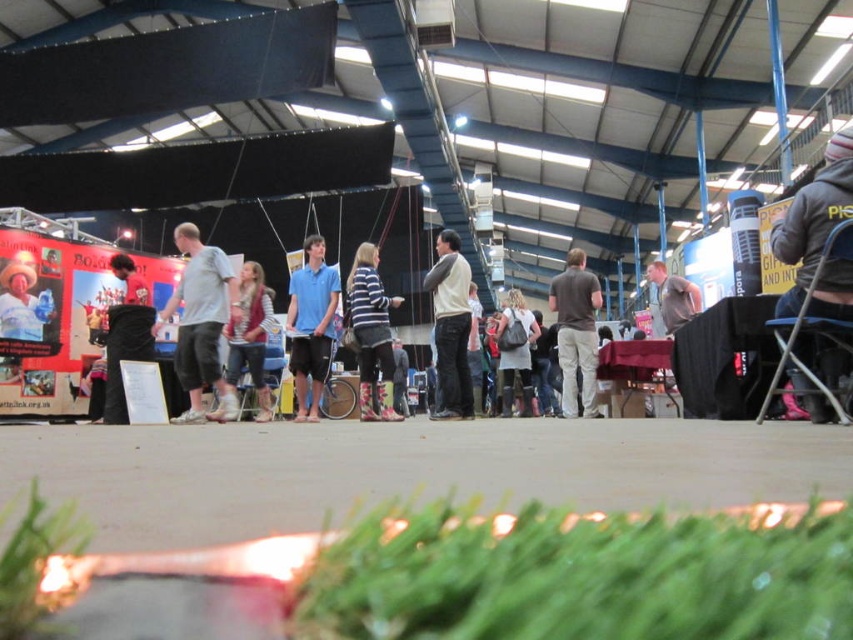
You are a delivery robot with a width of 1.5 meters. You need to move from the fluffy beige backpack at center to the gray matte shirt at center. Can you pass through the space between them?

The distance between the fluffy beige backpack at center and the gray matte shirt at center is 1.66 meters. Since the robot is 1.5 meters wide, it can pass through the space between them as there is enough clearance.

You are organizing a clothing display and need to stack the blue cotton shirt at center and the brown cotton shirt at center vertically. Which shirt should you place on the bottom to ensure stability?

The brown cotton shirt at center should be placed on the bottom because it is thicker than the blue cotton shirt at center, providing a more stable base for the stack.

You are a delivery person who needs to place a camera on a shelf behind the fluffy beige backpack at center. The shelf is 2 feet wide. Can you fit the camera on the shelf without moving the backpack?

The fluffy beige backpack at center and camera are 26.61 feet apart, so the distance between them is too large to fit the camera on the shelf which is only 2 feet wide. You will need to move the backpack or choose a different shelf.